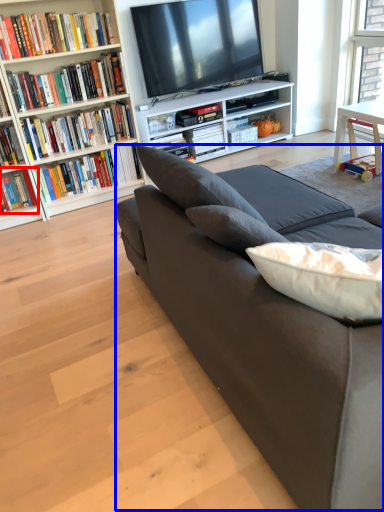
Question: Among these objects, which one is farthest to the camera, book (highlighted by a red box) or couch (highlighted by a blue box)?

Choices:
 (A) book
 (B) couch

Answer: (A)